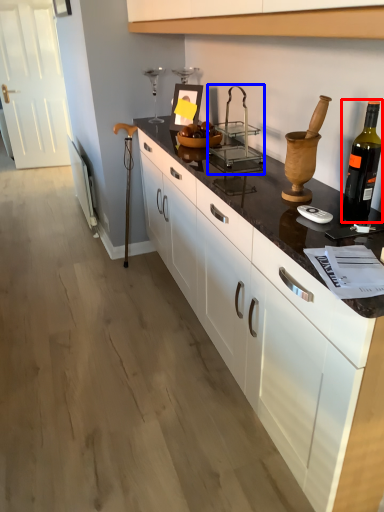
Question: Which of the following is the farthest to the observer, bottle (highlighted by a red box) or appliance (highlighted by a blue box)?

Choices:
 (A) bottle
 (B) appliance

Answer: (B)